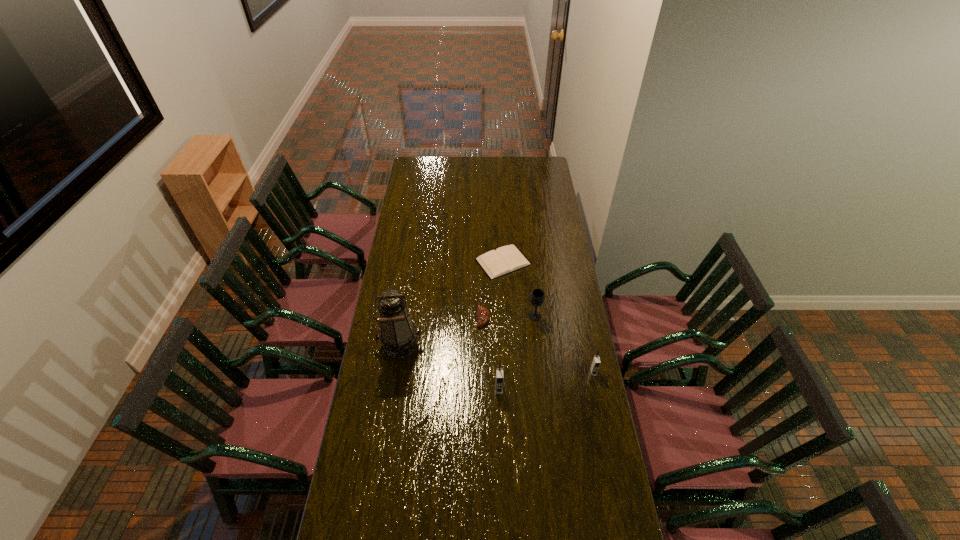
Locate an element on the screen. Image resolution: width=960 pixels, height=540 pixels. free space located 0.150m on the front-facing side of the left cellular telephone is located at coordinates (500, 431).

Find the location of `free point located 0.260m on the front-facing side of the farther cellular telephone`. free point located 0.260m on the front-facing side of the farther cellular telephone is located at coordinates (607, 438).

At what (x,y) coordinates should I click in order to perform the action: click on free location located on the front of the wineglass. Please return your answer as a coordinate pair (x, y). Looking at the image, I should click on (537, 330).

The width and height of the screenshot is (960, 540). I want to click on free space located on the back of the hardback book, so click(x=502, y=239).

At what (x,y) coordinates should I click in order to perform the action: click on vacant space located on the right of the tallest object. Please return your answer as a coordinate pair (x, y). The height and width of the screenshot is (540, 960). Looking at the image, I should click on click(x=463, y=345).

I want to click on vacant space located 0.130m on the back of the crescent roll, so click(x=483, y=287).

The image size is (960, 540). Find the location of `object that is positioned at the left edge`. object that is positioned at the left edge is located at coordinates (398, 334).

Find the location of a particular element. The width and height of the screenshot is (960, 540). object present at the right edge is located at coordinates (595, 364).

This screenshot has height=540, width=960. Identify the location of free region at the far edge of the desktop. (472, 157).

In order to click on vacant region at the left edge of the desktop in this screenshot , I will do `click(409, 275)`.